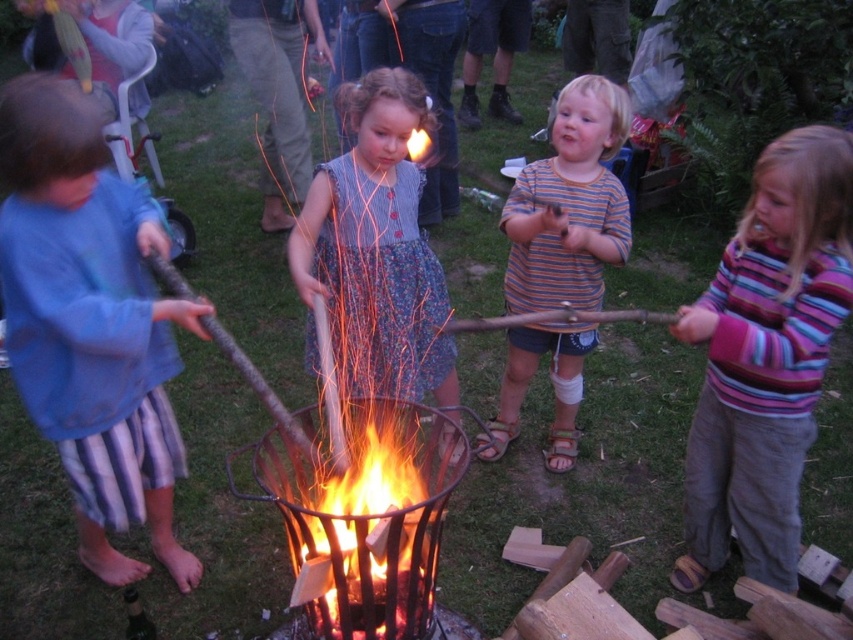
The height and width of the screenshot is (640, 853). Describe the element at coordinates (766, 356) in the screenshot. I see `striped sweater at center` at that location.

Does striped sweater at center have a smaller size compared to floral dress at center?

Yes, striped sweater at center is smaller than floral dress at center.

Between point (836, 166) and point (312, 200), which one is positioned in front?

Point (836, 166)

What are the coordinates of `striped sweater at center` in the screenshot? It's located at (766, 356).

Which of these two, blue cotton shirt at left or striped sweater at center, stands taller?

blue cotton shirt at left

Is the position of blue cotton shirt at left less distant than that of striped sweater at center?

Yes.

Does point (109, 502) come farther from viewer compared to point (827, 176)?

Yes, point (109, 502) is farther from viewer.

The image size is (853, 640). Find the location of `blue cotton shirt at left`. blue cotton shirt at left is located at coordinates (91, 323).

Does blue cotton shirt at left have a smaller size compared to floral dress at center?

No.

Who is shorter, blue cotton shirt at left or floral dress at center?

With less height is floral dress at center.

Does point (178, 310) come closer to viewer compared to point (379, 268)?

Yes.

At what (x,y) coordinates should I click in order to perform the action: click on blue cotton shirt at left. Please return your answer as a coordinate pair (x, y). This screenshot has width=853, height=640. Looking at the image, I should click on (91, 323).